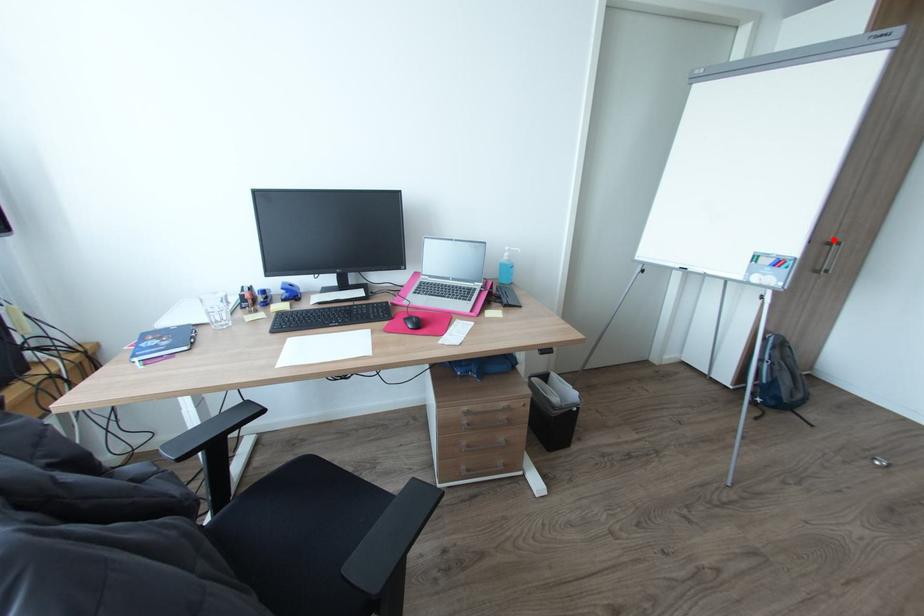
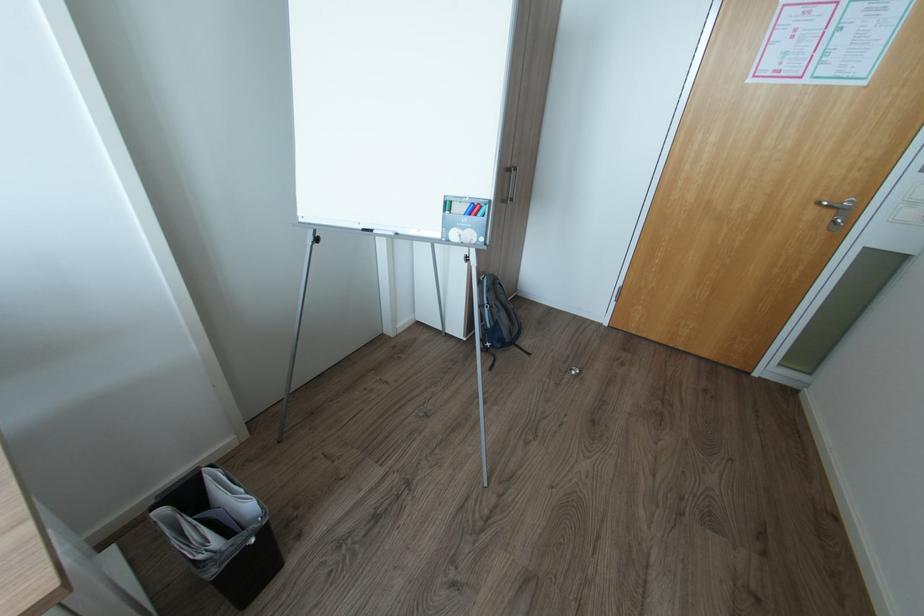
Find the pixel in the second image that matches the highlighted location in the first image.

(514, 166)